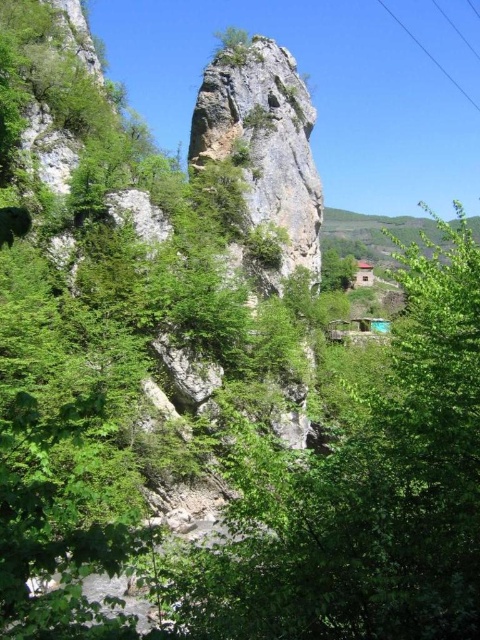
Question: Does green leafy tree at center come behind clear plastic power lines at upper right?

Choices:
 (A) no
 (B) yes

Answer: (A)

Question: From the image, what is the correct spatial relationship of green leafy tree at center in relation to rough stone rock at center?

Choices:
 (A) above
 (B) below

Answer: (B)

Question: Which of the following is the closest to the observer?

Choices:
 (A) (208, 68)
 (B) (477, 394)

Answer: (B)

Question: Where is green leafy tree at center located in relation to clear plastic power lines at upper right in the image?

Choices:
 (A) left
 (B) right

Answer: (A)

Question: Which point is farther to the camera?

Choices:
 (A) (262, 225)
 (B) (386, 6)

Answer: (B)

Question: Which point is closer to the camera?

Choices:
 (A) rough stone rock at center
 (B) clear plastic power lines at upper right

Answer: (A)